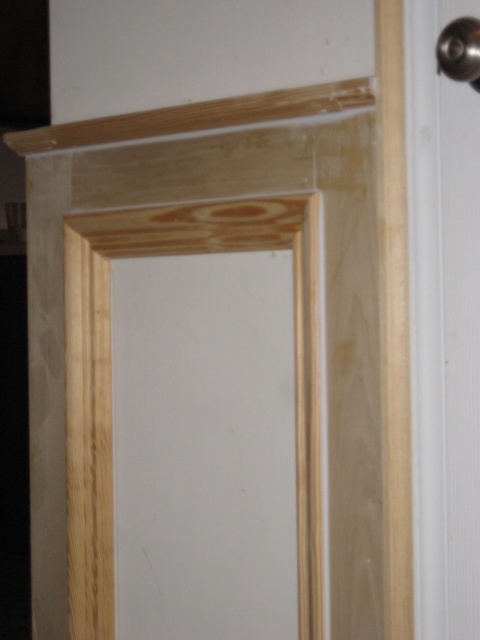
Is natural wood door at center taller than polished metal door handle at upper right?

Indeed, natural wood door at center has a greater height compared to polished metal door handle at upper right.

Does natural wood door at center appear under polished metal door handle at upper right?

Yes.

Between point (271, 243) and point (444, 51), which one is positioned in front?

Point (444, 51) is more forward.

This screenshot has width=480, height=640. In order to click on natural wood door at center in this screenshot , I will do `click(110, 378)`.